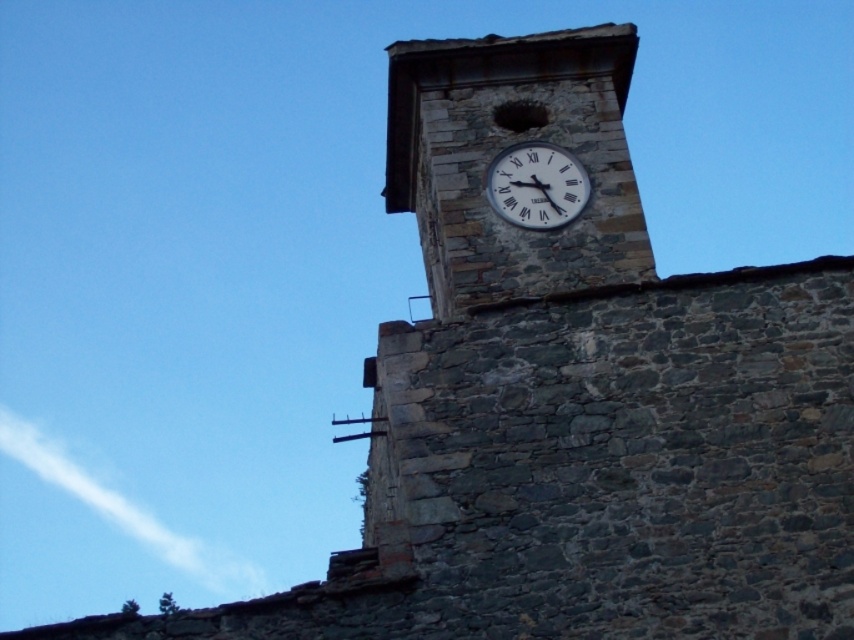
Question: Which point appears closest to the camera in this image?

Choices:
 (A) (544, 284)
 (B) (576, 163)

Answer: (A)

Question: Is rustic stone clock tower at upper center further to camera compared to white matte clock at upper center?

Choices:
 (A) no
 (B) yes

Answer: (A)

Question: Is rustic stone clock tower at upper center positioned in front of white matte clock at upper center?

Choices:
 (A) no
 (B) yes

Answer: (B)

Question: Is rustic stone clock tower at upper center positioned in front of white matte clock at upper center?

Choices:
 (A) yes
 (B) no

Answer: (A)